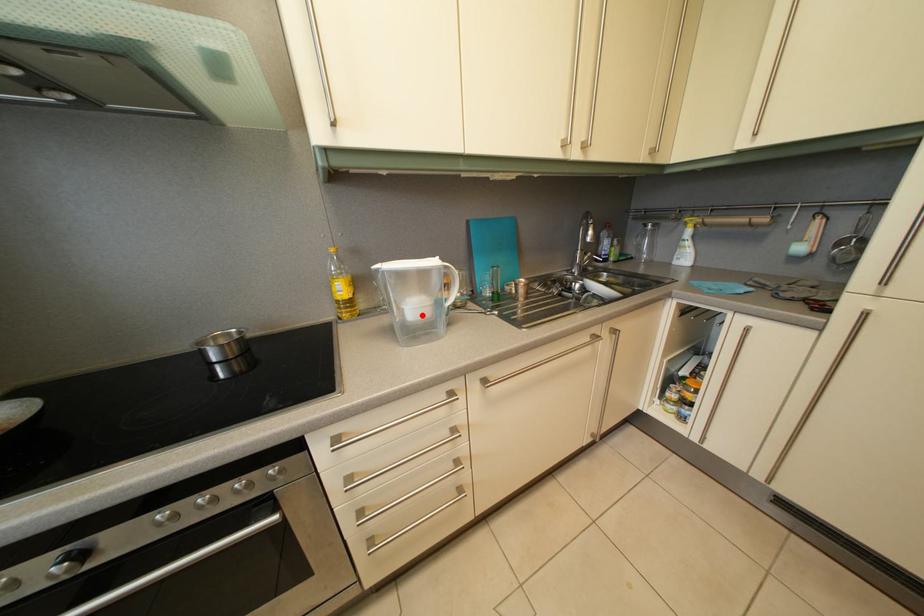
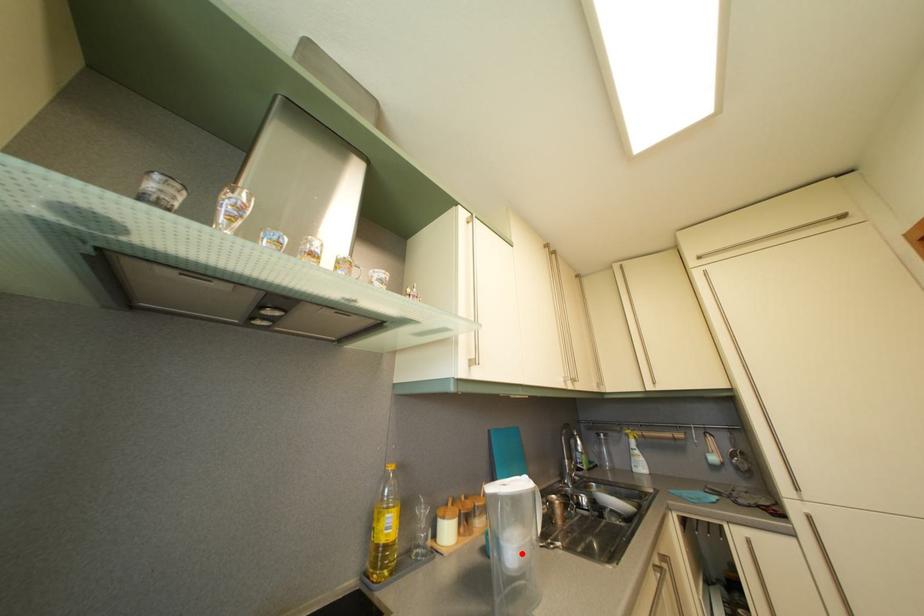
I am providing you with two images of the same scene from different viewpoints. A red point is marked on the first image and another point is marked on the second image. Does the point marked in image1 correspond to the same location as the one in image2?

Yes